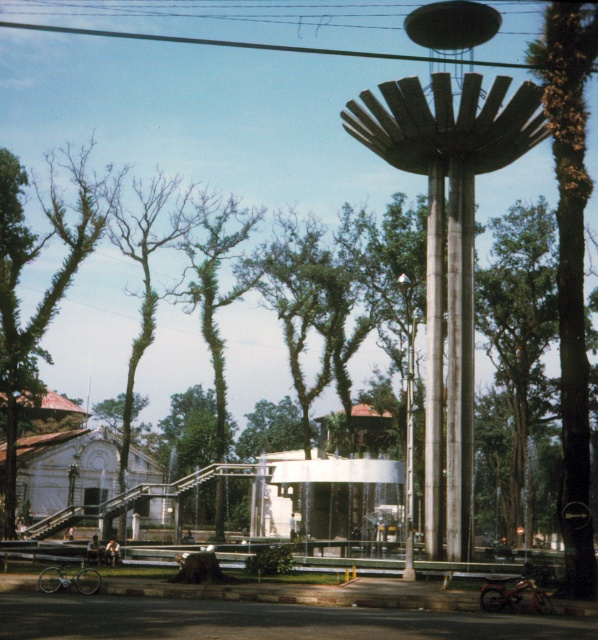
Between point (411, 168) and point (565, 448), which one is positioned behind?

Point (411, 168)

Which is above, metallic silver water tower at center right or green leafy tree at right?

Positioned higher is metallic silver water tower at center right.

Does point (446, 156) come closer to viewer compared to point (572, 268)?

No, (446, 156) is behind (572, 268).

At what (x,y) coordinates should I click in order to perform the action: click on metallic silver water tower at center right. Please return your answer as a coordinate pair (x, y). The width and height of the screenshot is (598, 640). Looking at the image, I should click on (448, 250).

From the picture: Does green leafy tree at right appear on the left side of green leafy tree at left?

In fact, green leafy tree at right is to the right of green leafy tree at left.

The height and width of the screenshot is (640, 598). What do you see at coordinates (570, 266) in the screenshot?
I see `green leafy tree at right` at bounding box center [570, 266].

Which is behind, point (581, 460) or point (30, 248)?

Positioned behind is point (30, 248).

At what (x,y) coordinates should I click in order to perform the action: click on green leafy tree at right. Please return your answer as a coordinate pair (x, y). The image size is (598, 640). Looking at the image, I should click on (570, 266).

Can you confirm if metallic silver water tower at center right is bigger than green leafy tree at left?

No, metallic silver water tower at center right is not bigger than green leafy tree at left.

Does metallic silver water tower at center right appear on the right side of green leafy tree at left?

Correct, you'll find metallic silver water tower at center right to the right of green leafy tree at left.

The height and width of the screenshot is (640, 598). Find the location of `metallic silver water tower at center right`. metallic silver water tower at center right is located at coordinates (448, 250).

This screenshot has height=640, width=598. Identify the location of metallic silver water tower at center right. (448, 250).